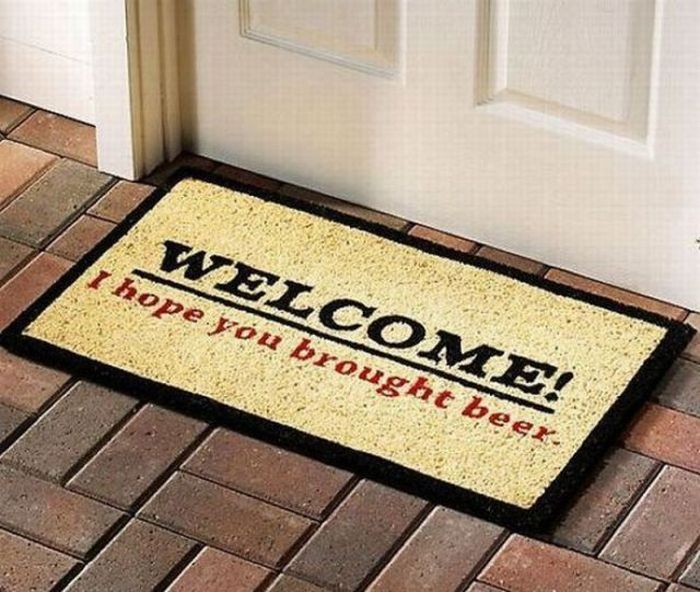
Where is `floor`? floor is located at coordinates (210, 534).